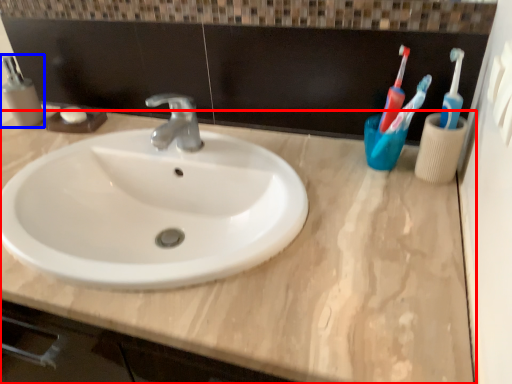
Question: Which of the following is the closest to the observer, counter top (highlighted by a red box) or mouthwash (highlighted by a blue box)?

Choices:
 (A) counter top
 (B) mouthwash

Answer: (A)